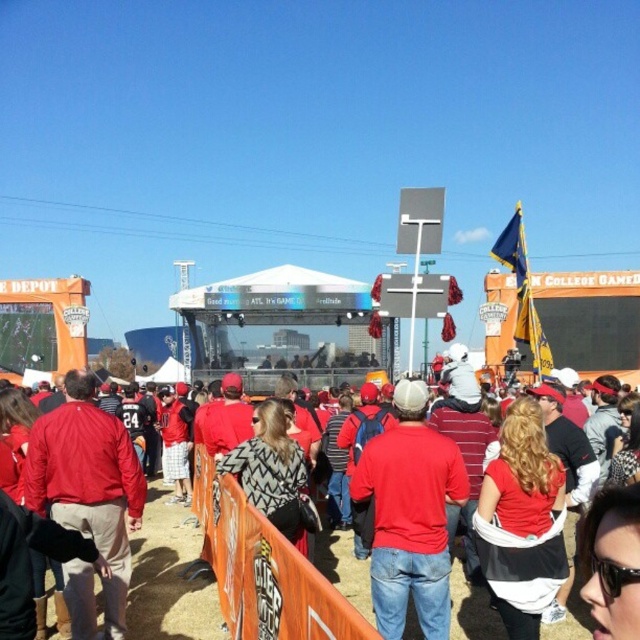
Can you confirm if red fabric jacket at center is positioned to the left of matte red jacket at center?

In fact, red fabric jacket at center is to the right of matte red jacket at center.

Which of these two, red fabric jacket at center or matte red jacket at center, stands shorter?

red fabric jacket at center is shorter.

Between point (195, 588) and point (92, 584), which one is positioned behind?

Positioned behind is point (195, 588).

Find the location of a particular element. Image resolution: width=640 pixels, height=640 pixels. red fabric jacket at center is located at coordinates (170, 577).

Between matte red shirt at center and matte red jacket at center, which one has less height?

matte red jacket at center

Can you confirm if matte red shirt at center is smaller than matte red jacket at center?

Incorrect, matte red shirt at center is not smaller in size than matte red jacket at center.

Is point (436, 444) closer to camera compared to point (65, 502)?

No, it is behind (65, 502).

The height and width of the screenshot is (640, 640). What are the coordinates of `matte red shirt at center` in the screenshot? It's located at (410, 515).

Is point (372, 497) positioned behind point (467, 618)?

Yes, it is behind point (467, 618).

Which of these two, matte red shirt at center or red fabric jacket at center, stands taller?

matte red shirt at center is taller.

Which is behind, point (394, 449) or point (156, 534)?

Positioned behind is point (156, 534).

Identify the location of matte red shirt at center. (410, 515).